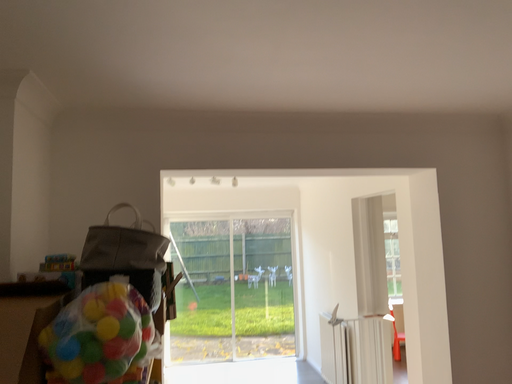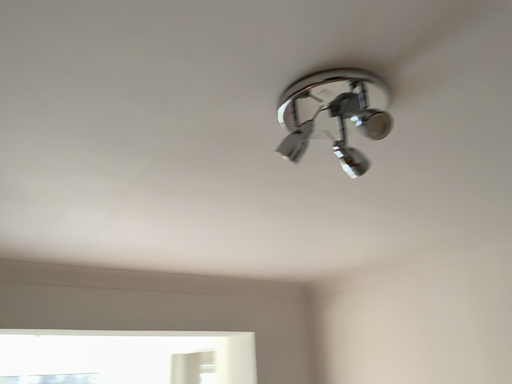
Question: How did the camera likely rotate when shooting the video?

Choices:
 (A) rotated downward
 (B) rotated upward

Answer: (B)